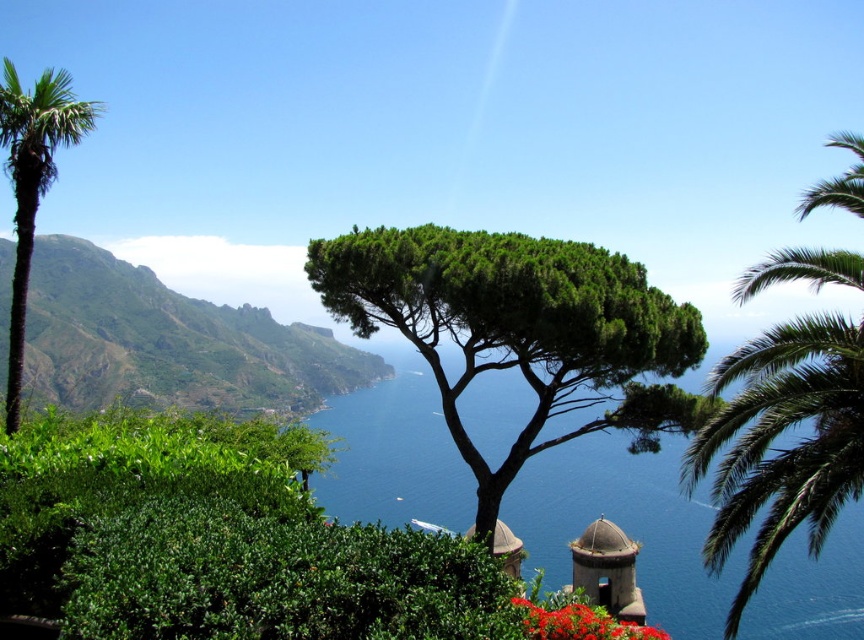
Locate an element on the screen. This screenshot has width=864, height=640. green leafy tree at center is located at coordinates (519, 330).

Can you confirm if green leafy tree at center is wider than green leafy hillside at upper left?

No, green leafy tree at center is not wider than green leafy hillside at upper left.

In order to click on green leafy tree at center in this screenshot , I will do `click(519, 330)`.

The width and height of the screenshot is (864, 640). What are the coordinates of `green leafy tree at center` in the screenshot? It's located at (519, 330).

Does green leafy palm tree at right have a greater height compared to bright red petals at center?

Yes.

Which is in front, point (799, 518) or point (658, 632)?

Point (799, 518) is in front.

The image size is (864, 640). I want to click on green leafy palm tree at right, so click(782, 449).

Can you confirm if green leafy palm tree at left is thinner than bright red petals at center?

No, green leafy palm tree at left is not thinner than bright red petals at center.

Which is more to the left, green leafy palm tree at left or bright red petals at center?

Positioned to the left is green leafy palm tree at left.

Is point (7, 170) positioned after point (631, 636)?

Yes, point (7, 170) is farther from viewer.

Where is `green leafy palm tree at left`? Image resolution: width=864 pixels, height=640 pixels. green leafy palm tree at left is located at coordinates (32, 182).